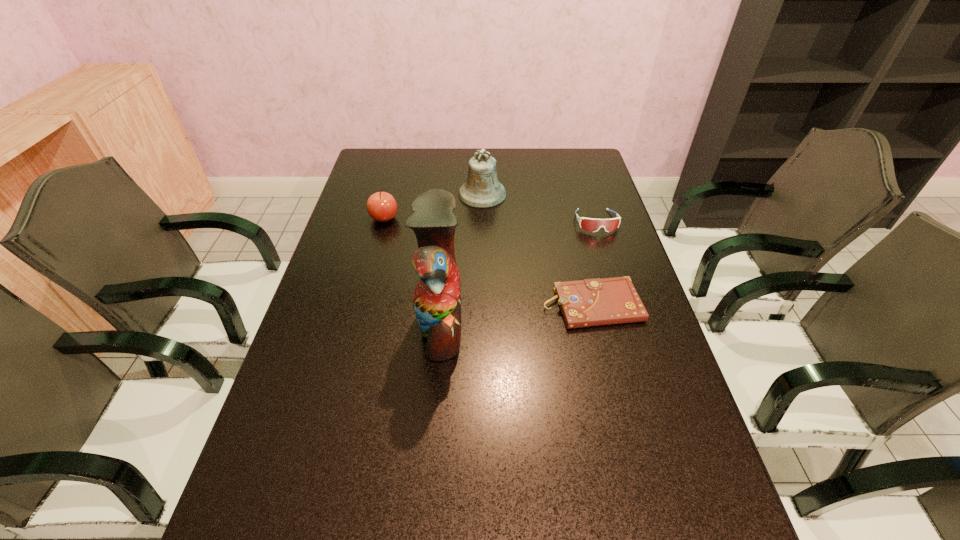
You are a GUI agent. You are given a task and a screenshot of the screen. Output one action in this format:
    pyautogui.click(x=<x>, y=<y>)
    Task: Click on the vacant space that is in between the shortest object and the parrot
    
    Given the screenshot: What is the action you would take?
    pyautogui.click(x=516, y=315)

At what (x,y) coordinates should I click in order to perform the action: click on unoccupied position between the shortest object and the goggles. Please return your answer as a coordinate pair (x, y). The image size is (960, 540). Looking at the image, I should click on (594, 264).

This screenshot has height=540, width=960. I want to click on vacant area between the parrot and the shortest object, so click(516, 315).

At what (x,y) coordinates should I click in order to perform the action: click on empty location between the farthest object and the parrot. Please return your answer as a coordinate pair (x, y). The image size is (960, 540). Looking at the image, I should click on (462, 259).

Where is `empty location between the notebook and the goggles`? The width and height of the screenshot is (960, 540). empty location between the notebook and the goggles is located at coordinates (594, 264).

Identify the location of free point between the parrot and the third shortest object. The height and width of the screenshot is (540, 960). (413, 271).

The width and height of the screenshot is (960, 540). I want to click on vacant space in between the fourth tallest object and the bell, so click(x=540, y=208).

This screenshot has width=960, height=540. What are the coordinates of `object that is the closest one to the third tallest object` in the screenshot? It's located at (481, 189).

Identify the location of the third closest object to the parrot. (481, 189).